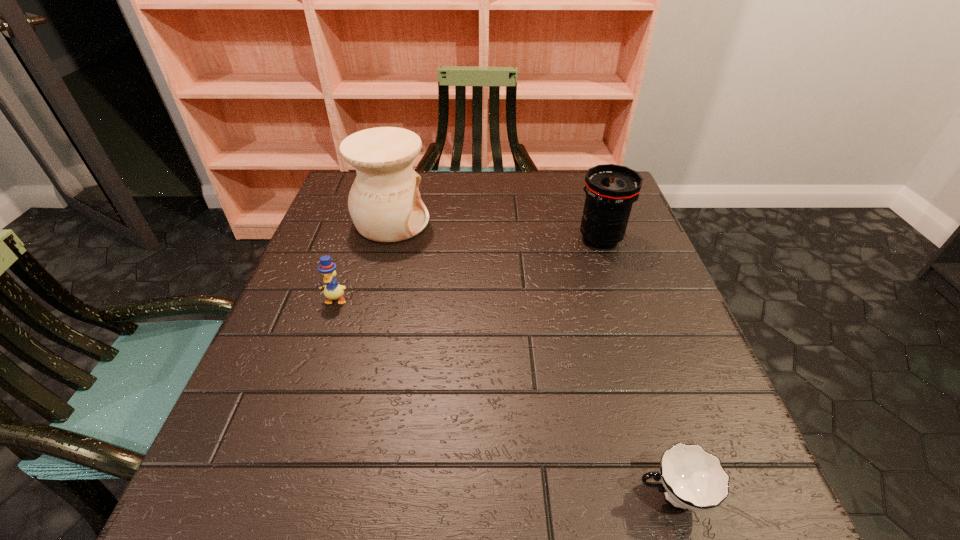
What are the coordinates of `free space located 0.140m on the side of the cup with the handle` in the screenshot? It's located at (535, 495).

Locate an element on the screen. free space located on the side of the cup with the handle is located at coordinates (458, 495).

Find the location of a particular element. object that is at the far edge is located at coordinates (384, 202).

Image resolution: width=960 pixels, height=540 pixels. In order to click on object that is at the near edge in this screenshot , I will do `click(692, 478)`.

This screenshot has width=960, height=540. In order to click on pottery at the left edge in this screenshot , I will do `click(384, 202)`.

Find the location of a particular element. The height and width of the screenshot is (540, 960). duckling present at the left edge is located at coordinates (327, 268).

Identify the location of telephoto lens that is positioned at the right edge. (610, 189).

This screenshot has height=540, width=960. I want to click on cup located at the right edge, so click(692, 478).

Where is `object at the far left corner`? The width and height of the screenshot is (960, 540). object at the far left corner is located at coordinates (384, 202).

The width and height of the screenshot is (960, 540). I want to click on object that is positioned at the near right corner, so click(692, 478).